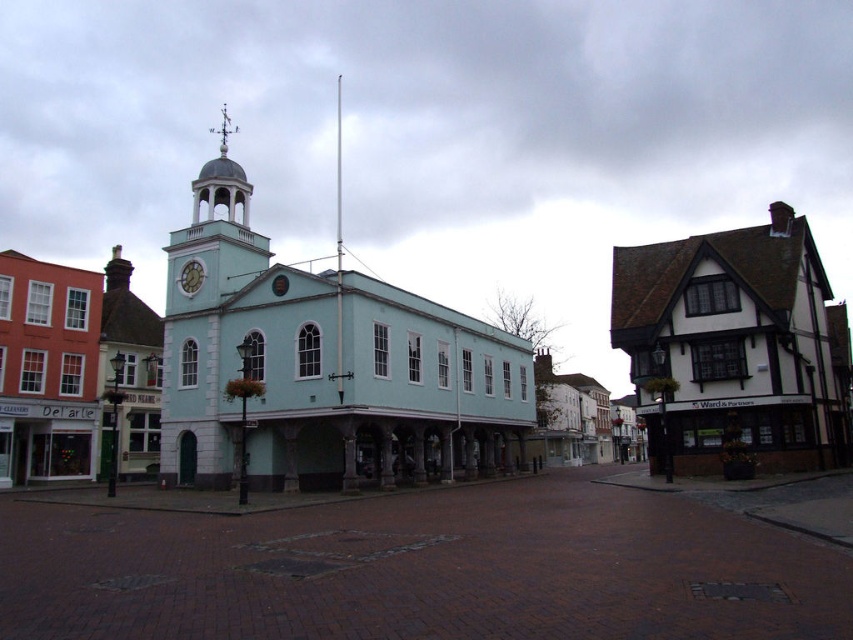
Can you confirm if brick pavement at center is taller than white wood-framed building at right?

No, brick pavement at center is not taller than white wood-framed building at right.

Can you confirm if brick pavement at center is positioned to the left of white wood-framed building at right?

Yes, brick pavement at center is to the left of white wood-framed building at right.

Does point (393, 582) come closer to viewer compared to point (759, 362)?

Yes, point (393, 582) is closer to viewer.

Where is `brick pavement at center`? The width and height of the screenshot is (853, 640). brick pavement at center is located at coordinates (422, 570).

Who is positioned more to the left, brick pavement at center or light blue painted wood at center?

Positioned to the left is light blue painted wood at center.

Does brick pavement at center come in front of light blue painted wood at center?

Yes, it is in front of light blue painted wood at center.

This screenshot has height=640, width=853. I want to click on brick pavement at center, so click(x=422, y=570).

In order to click on brick pavement at center in this screenshot , I will do `click(422, 570)`.

Which of these two, brick pavement at center or teal painted clock at center, stands taller?

With more height is brick pavement at center.

Who is higher up, brick pavement at center or teal painted clock at center?

Positioned higher is teal painted clock at center.

Which is in front, point (758, 525) or point (201, 266)?

Point (758, 525)

Identify the location of brick pavement at center. (422, 570).